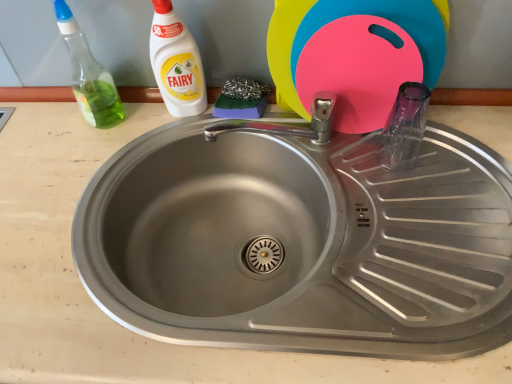
Locate an element on the screen. unoccupied region to the right of transparent glass bottle at right is located at coordinates (462, 154).